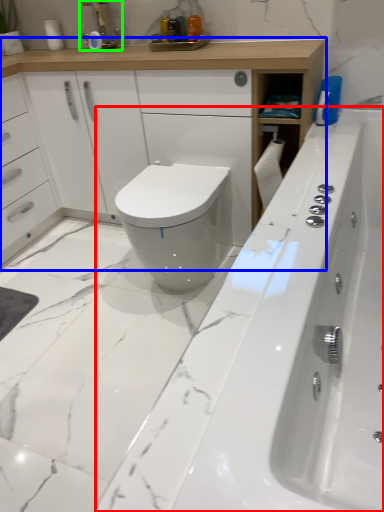
Question: Which object is the farthest from bath (highlighted by a red box)? Choose among these: bathroom cabinet (highlighted by a blue box) or faucet (highlighted by a green box).

Choices:
 (A) bathroom cabinet
 (B) faucet

Answer: (B)